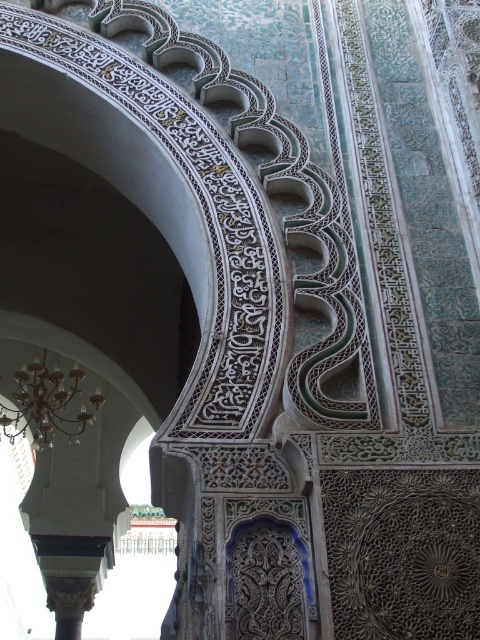
Which is in front, point (55, 368) or point (56, 600)?

Point (56, 600) is more forward.

Is point (51, 397) positioned before point (61, 634)?

No, (51, 397) is further to viewer.

I want to click on gold metallic chandelier at upper center, so click(47, 404).